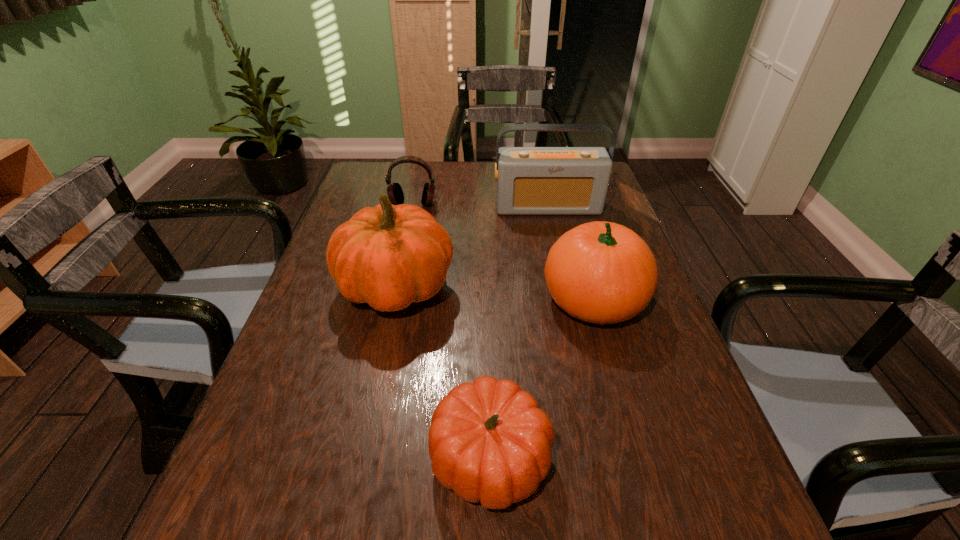
Locate an element on the screen. Image resolution: width=960 pixels, height=540 pixels. radio receiver is located at coordinates (530, 180).

Image resolution: width=960 pixels, height=540 pixels. I want to click on the tallest pumpkin, so click(x=389, y=256).

The height and width of the screenshot is (540, 960). What are the coordinates of `the third tallest object` in the screenshot? It's located at pos(601,272).

Identify the location of the second shortest pumpkin. This screenshot has width=960, height=540. (601, 272).

This screenshot has height=540, width=960. I want to click on headset, so 395,193.

At what (x,y) coordinates should I click in order to perform the action: click on the nearest object. Please return your answer as a coordinate pair (x, y). The image size is (960, 540). Looking at the image, I should click on click(489, 442).

At what (x,y) coordinates should I click in order to perform the action: click on the shortest pumpkin. Please return your answer as a coordinate pair (x, y). Looking at the image, I should click on (489, 442).

Locate an element on the screen. vacant space located on the front-facing side of the radio receiver is located at coordinates (559, 256).

Where is `vacant space located 0.120m on the front of the tallest pumpkin`? The height and width of the screenshot is (540, 960). vacant space located 0.120m on the front of the tallest pumpkin is located at coordinates (377, 377).

What are the coordinates of `blank space located on the left of the rightmost pumpkin` in the screenshot? It's located at (390, 299).